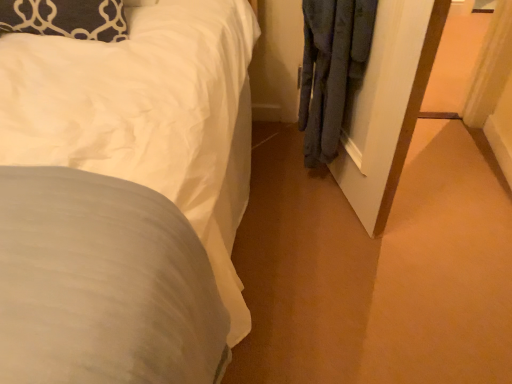
Question: Should I look upward or downward to see dark blue textured pillow at upper left?

Choices:
 (A) down
 (B) up

Answer: (B)